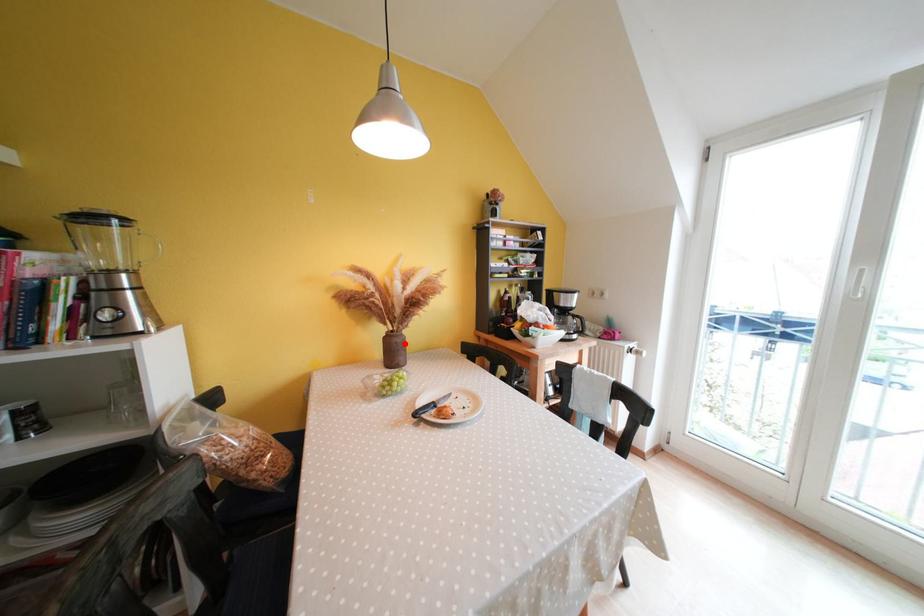
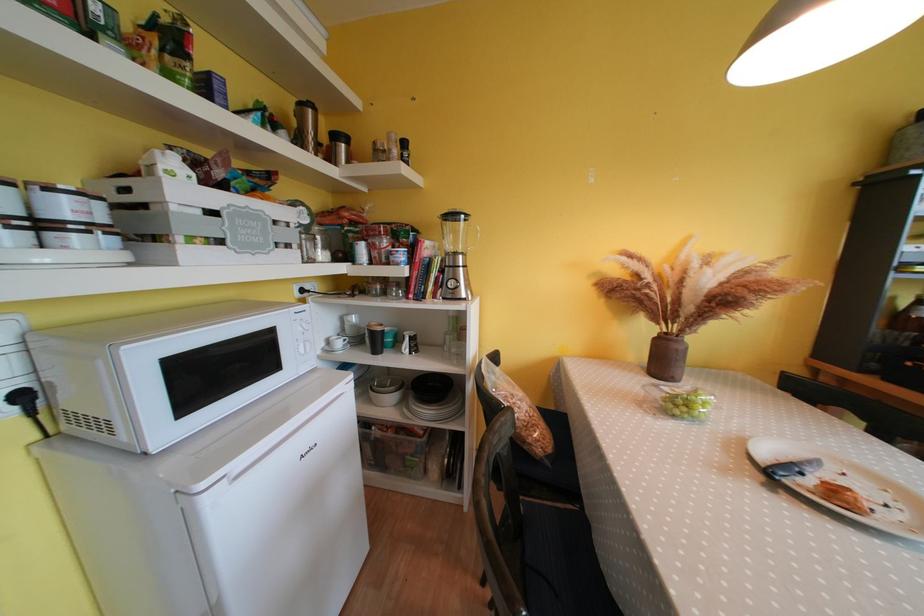
Locate, in the second image, the point that corresponds to the highlighted location in the first image.

(687, 351)